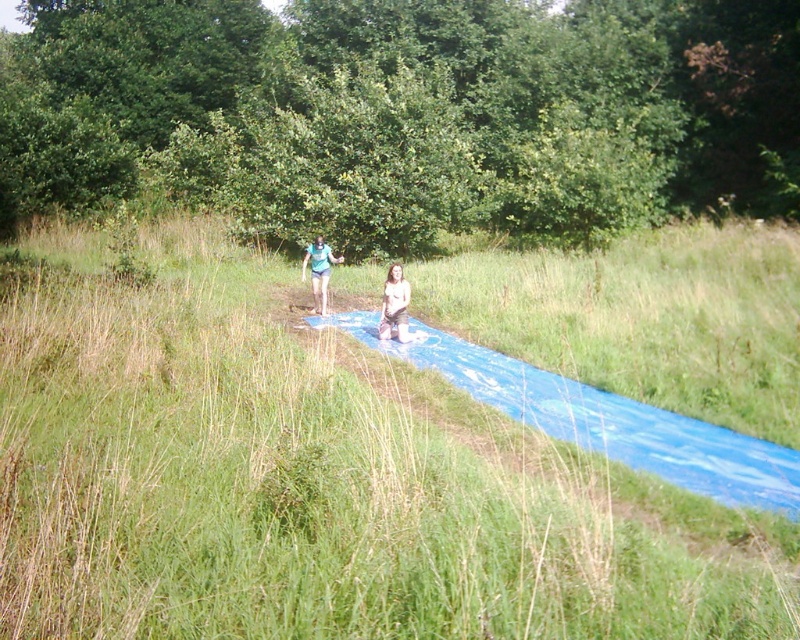
You are a parent supervising children playing on the slip and slide. You see the blue rubber mat at center and the matte blue shorts at center. Which object is closer to the ground?

The blue rubber mat at center is below matte blue shorts at center, so the blue rubber mat at center is closer to the ground.

You are standing at the point marked as point (396, 307). You want to slide down the slip and slide. Is the slip and slide long enough to reach the end of the slide without falling off?

The tan skin person at center is located at point (396, 307). The slip and slide is long enough to reach the end of the slide without falling off.